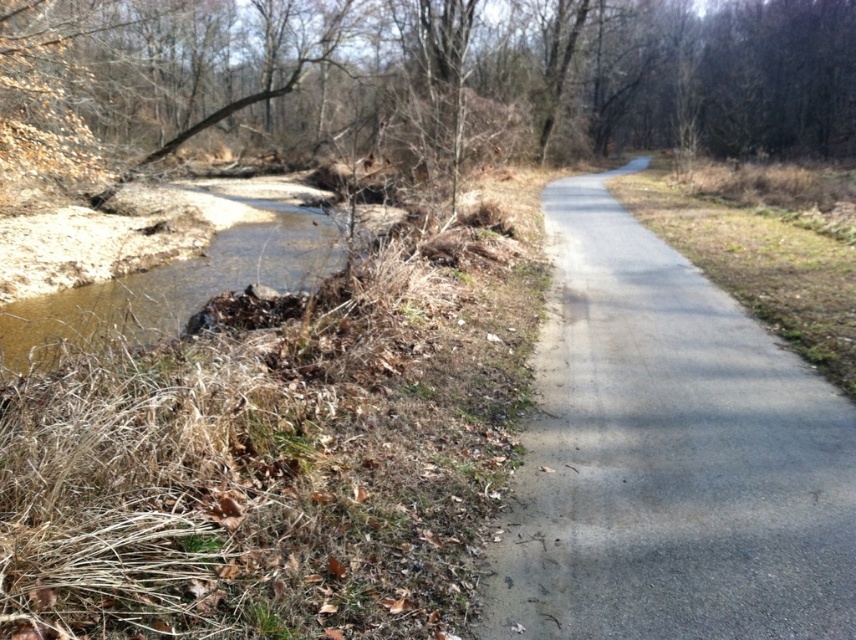
You are a hiker who wants to take a photo of the gray asphalt trail at center and the brown leafy tree at upper left. If you want the tree to appear in front of the trail in the photo, where should you position yourself relative to the two objects?

You should position yourself so that the brown leafy tree at upper left is closer to you than the gray asphalt trail at center, as the gray asphalt trail at center is behind the brown leafy tree at upper left.

You are standing at the point closer to the camera between point (714,96) and point (846,493). Which point are you at?

You are at point (714,96) because it is closer to the camera than point (846,493).

You are a hiker who wants to take a photo of the gray asphalt trail at center from the brown leafy tree at upper left. Is the tree blocking your view of the trail?

The brown leafy tree at upper left is positioned over the gray asphalt trail at center, so it is blocking the view of the trail from that angle.